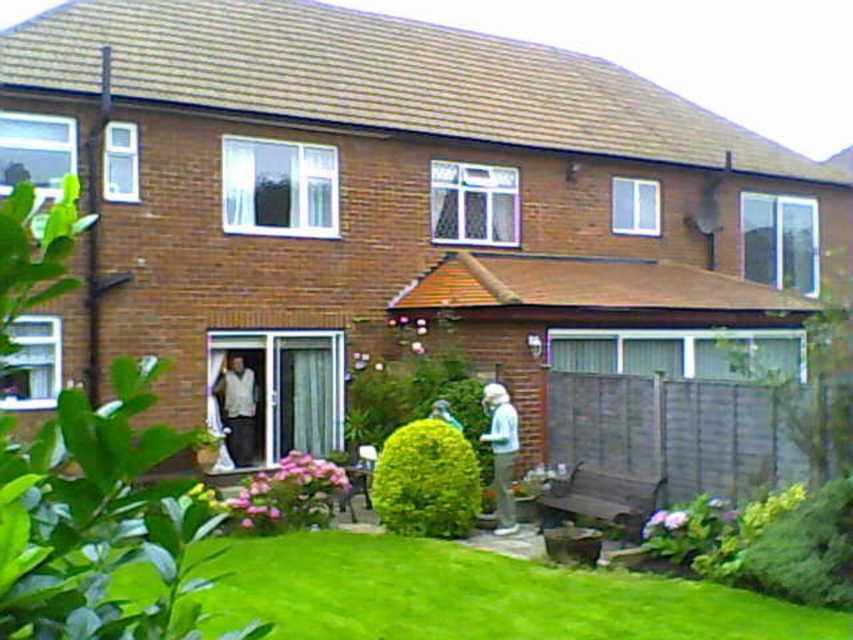
You are standing in front of the house and want to determine the relative positions of two points in the garden. Which of the two points, point (401, 541) or point (512, 515), is closer to you?

Point (401, 541) is closer to the camera than point (512, 515).

You are standing at the point with coordinates point (444, 406) and want to walk to the house. There is an obstacle at point (229, 444). Will you be able to see the house from your current position?

Point (229, 444) is behind point (444, 406), so the obstacle at point (229, 444) will not block your view of the house from your current position at point (444, 406).

You are a delivery person approaching the house and see the green leafy bush at center and the light blue fabric jacket at lower center. Which object is closer to the left side of the path leading to the house?

The green leafy bush at center is positioned on the left side of the light blue fabric jacket at lower center, so it is closer to the left side of the path leading to the house.